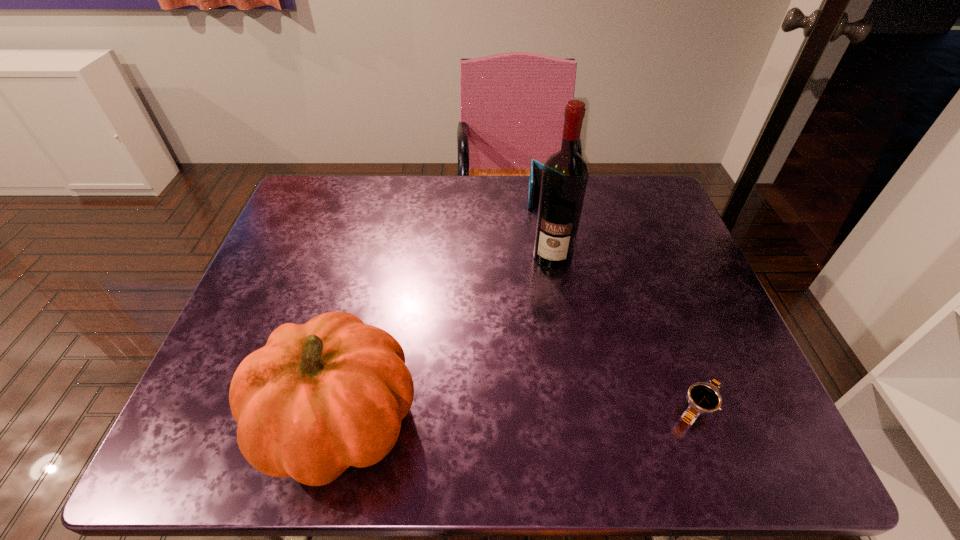
Where is `vacant space on the desktop that is between the third shortest object and the rightmost object and is positioned on the front and back of the tallest object`? This screenshot has width=960, height=540. vacant space on the desktop that is between the third shortest object and the rightmost object and is positioned on the front and back of the tallest object is located at coordinates (516, 414).

I want to click on vacant space on the desktop that is between the second tallest object and the rightmost object and is positioned on the exterior surface of the wallet, so click(x=546, y=413).